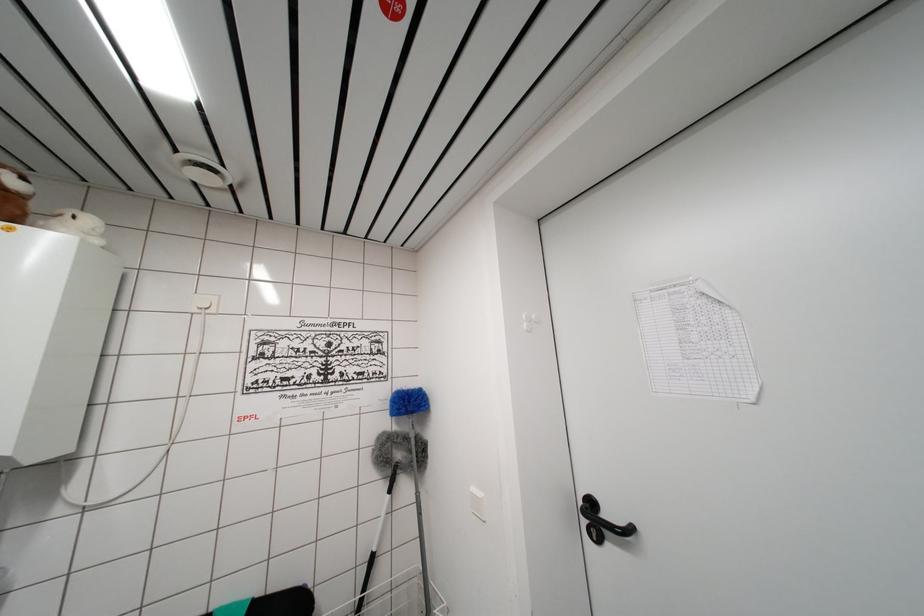
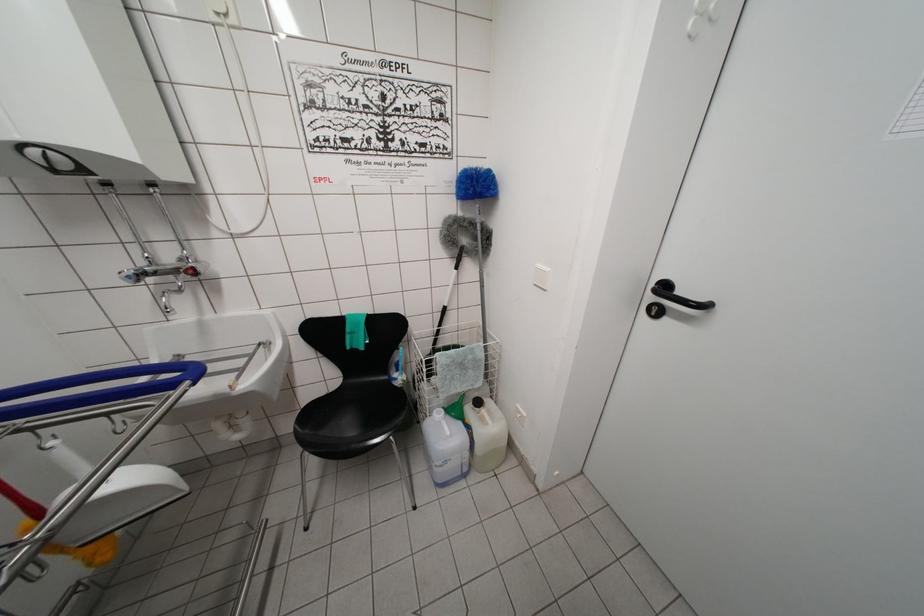
Find the pixel in the second image that matches (477,493) in the first image.

(542, 270)